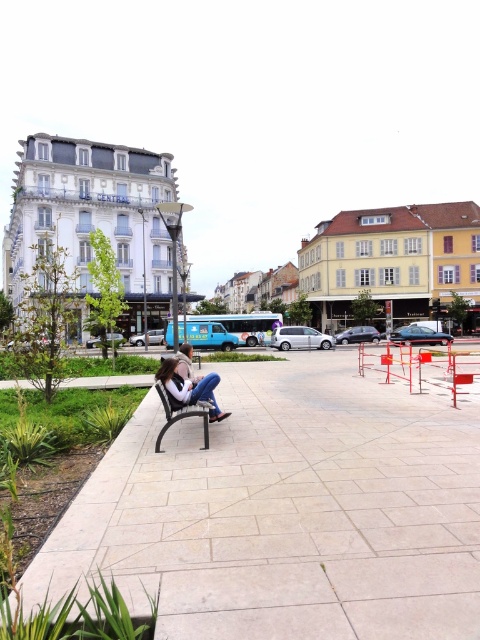
You are a photographer trying to capture both the denim jeans at lower left and the denim jacket at center in a single frame. Based on their sizes, which object should you focus on to ensure both fit comfortably in the photo?

The denim jeans at lower left occupies less space than the denim jacket at center, so focusing on the denim jacket at center would allow both to fit comfortably in the photo since it takes up more space and the jeans at lower left would naturally fit within the frame.

You are standing at the entrance of the plaza and want to sit on the black metal bench. Which direction should you walk to reach the light beige paving stone at center before reaching the bench?

The light beige paving stone at center is located at point (287, 512), so you should walk towards the center of the plaza to reach it before the bench.